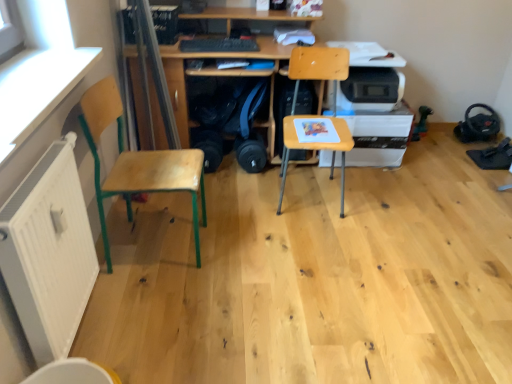
You are a GUI agent. You are given a task and a screenshot of the screen. Output one action in this format:
    pyautogui.click(x=<x>, y=<y>)
    Task: Click on the vacant area to the right of white plastic printer at center right
    The image size is (512, 384).
    Given the screenshot: What is the action you would take?
    pyautogui.click(x=435, y=159)